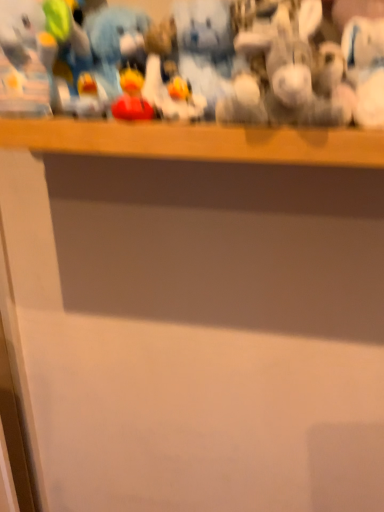
Question: Is fuzzy plush toy at center, positioned as the first toy in right-to-left order, taller or shorter than matte plastic toy at center, arranged as the 1th toy when ordered from the bottom?

Choices:
 (A) tall
 (B) short

Answer: (A)

Question: Is fuzzy plush toy at center, positioned as the first toy in right-to-left order, inside or outside of matte plastic toy at center, which is the 1th toy in front-to-back order?

Choices:
 (A) inside
 (B) outside

Answer: (B)

Question: Is point (198, 36) closer or farther from the camera than point (122, 102)?

Choices:
 (A) closer
 (B) farther

Answer: (B)

Question: Is matte plastic toy at center, arranged as the 1th toy when ordered from the bottom, wider or thinner than fuzzy plush toy at center, placed as the second toy when sorted from front to back?

Choices:
 (A) wide
 (B) thin

Answer: (B)

Question: Do you think matte plastic toy at center, which is the second toy from top to bottom, is within fuzzy plush toy at center, positioned as the first toy in right-to-left order, or outside of it?

Choices:
 (A) inside
 (B) outside

Answer: (B)

Question: Considering the positions of matte plastic toy at center, the 1th toy from the left, and fuzzy plush toy at center, marked as the first toy in a back-to-front arrangement, in the image, is matte plastic toy at center, the 1th toy from the left, taller or shorter than fuzzy plush toy at center, marked as the first toy in a back-to-front arrangement,?

Choices:
 (A) short
 (B) tall

Answer: (A)

Question: Is point (150, 110) positioned closer to the camera than point (182, 54)?

Choices:
 (A) closer
 (B) farther

Answer: (A)